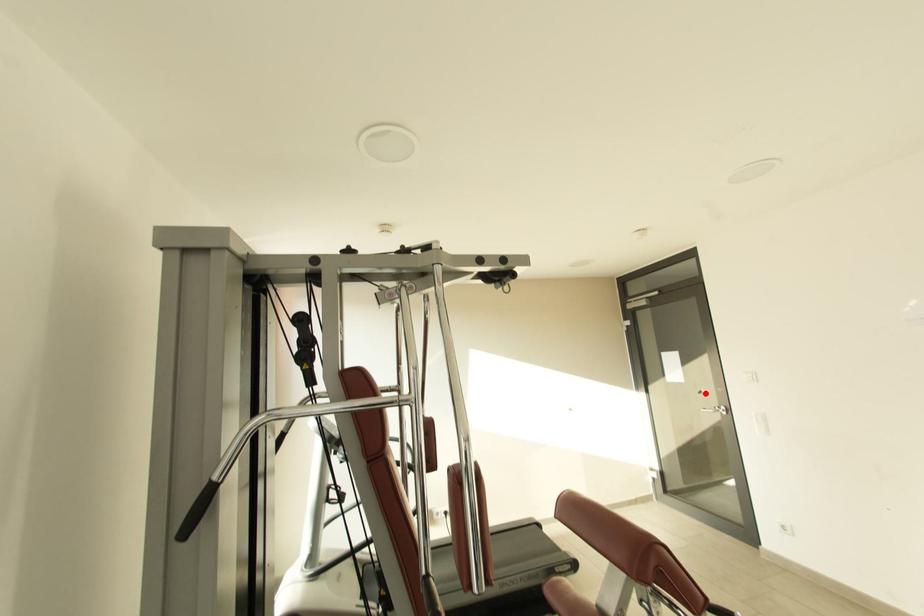
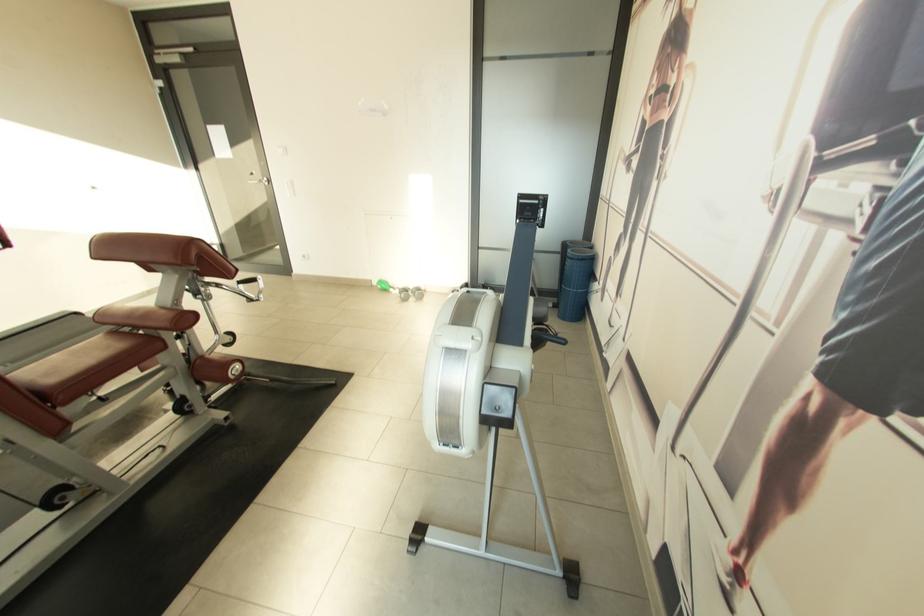
Question: I am providing you with two images of the same scene from different viewpoints. A red point is marked on the first image. Can you still see the location of the red point in image 2?

Choices:
 (A) Yes
 (B) No

Answer: (A)